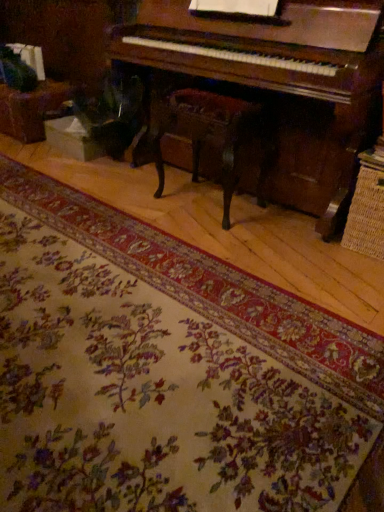
At what (x,y) coordinates should I click in order to perform the action: click on free space in front of wooden polished chair at center. Please return your answer as a coordinate pair (x, y). Looking at the image, I should click on (226, 241).